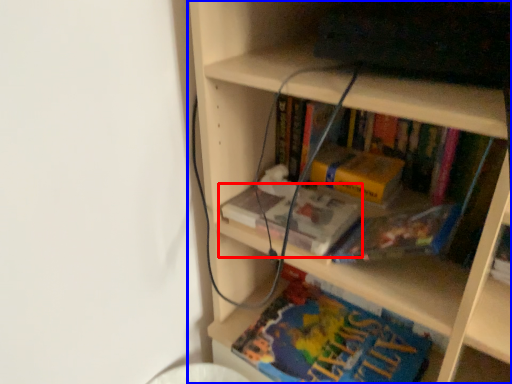
Question: Which point is further to the camera, book (highlighted by a red box) or bookcase (highlighted by a blue box)?

Choices:
 (A) book
 (B) bookcase

Answer: (A)